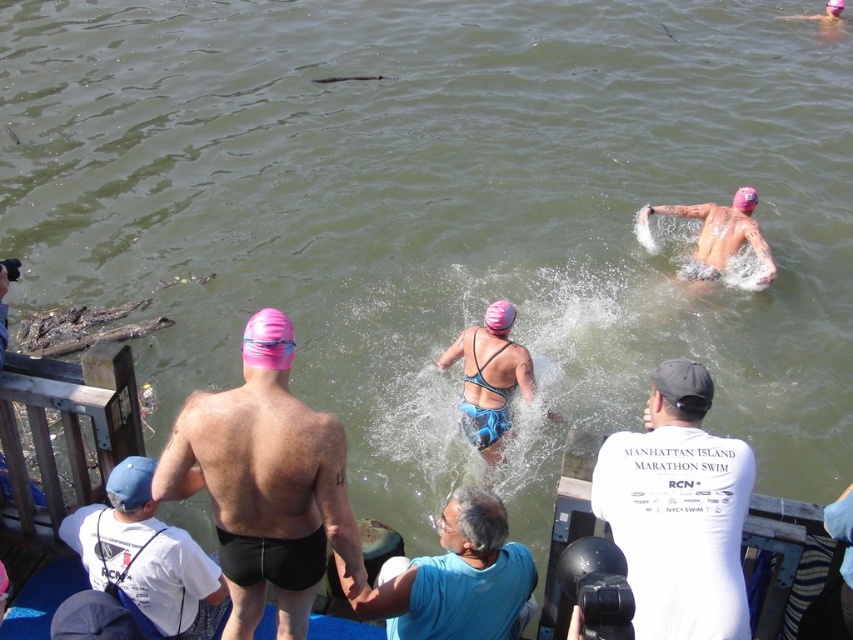
Question: From the image, what is the correct spatial relationship of pink matte swim cap at upper left in relation to pink rubber swim cap at center?

Choices:
 (A) right
 (B) left

Answer: (B)

Question: Does white cotton t-shirt at center appear on the left side of pink rubber swim cap at center?

Choices:
 (A) yes
 (B) no

Answer: (B)

Question: Which of the following is the closest to the observer?

Choices:
 (A) (502, 307)
 (B) (91, 570)

Answer: (B)

Question: Is the position of white cotton t-shirt at center less distant than that of pink matte swim cap at center?

Choices:
 (A) yes
 (B) no

Answer: (A)

Question: Which point appears closest to the camera in this image?

Choices:
 (A) (146, 496)
 (B) (426, 566)
 (C) (305, 508)

Answer: (C)

Question: Among these points, which one is farthest from the camera?

Choices:
 (A) (704, 268)
 (B) (502, 316)
 (C) (466, 518)

Answer: (A)